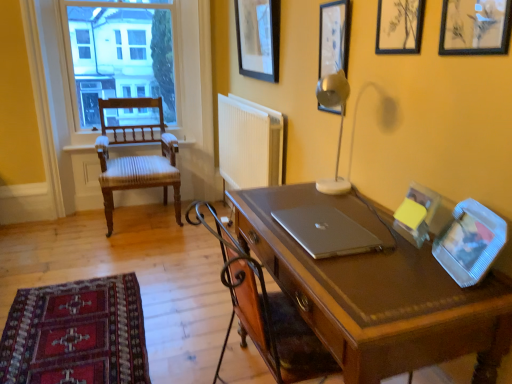
Question: Relative to metallic silver picture frame at upper right, the fourth picture frame viewed from the right, is matte brown desk at center in front or behind?

Choices:
 (A) behind
 (B) front

Answer: (B)

Question: Considering the positions of matte brown desk at center and metallic silver picture frame at upper right, placed as the fourth picture frame when sorted from front to back, in the image, is matte brown desk at center taller or shorter than metallic silver picture frame at upper right, placed as the fourth picture frame when sorted from front to back,?

Choices:
 (A) short
 (B) tall

Answer: (B)

Question: Which of these objects is positioned closest to the wooden chair with striped cushioning at left?

Choices:
 (A) wooden picture frame at upper right, the 3th picture frame from the left
 (B) silver metallic laptop at center
 (C) metallic silver picture frame at upper right, the second picture frame positioned from the left
 (D) clear glass window at upper left
 (E) clear plastic picture frame at right, which ranks as the fourth picture frame in back-to-front order

Answer: (D)

Question: Based on their relative distances, which object is farther from the silver metallic laptop at center?

Choices:
 (A) metallic silver table lamp at upper right
 (B) black matte picture frame at upper center, acting as the 1th picture frame starting from the left
 (C) clear glass window at upper left
 (D) black matte picture frame at upper right, arranged as the first picture frame when viewed from the front
 (E) clear plastic picture frame at right, arranged as the 2th picture frame when viewed from the front

Answer: (C)